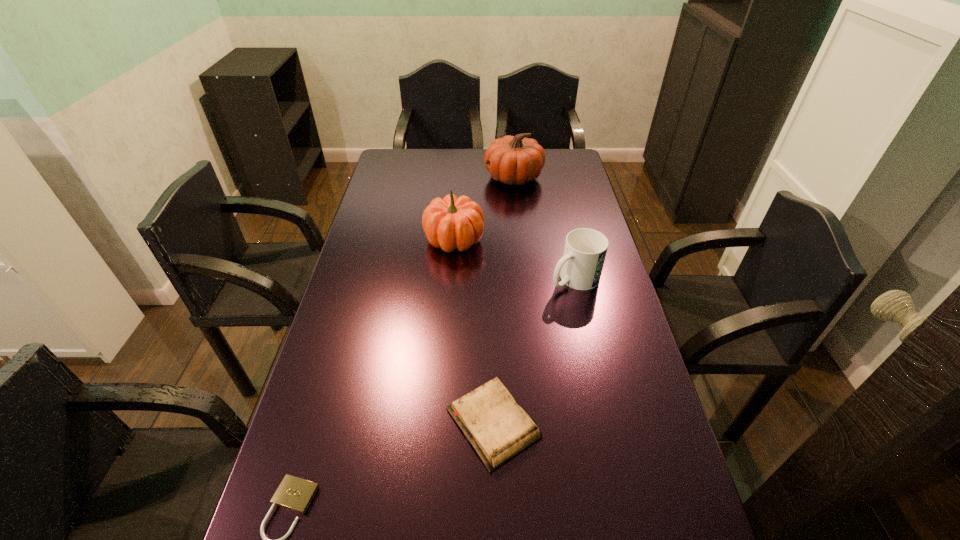
Locate an element on the screen. Image resolution: width=960 pixels, height=540 pixels. free spot that satisfies the following two spatial constraints: 1. on the face of the third shortest object; 2. on the left side of the farther pumpkin is located at coordinates (525, 279).